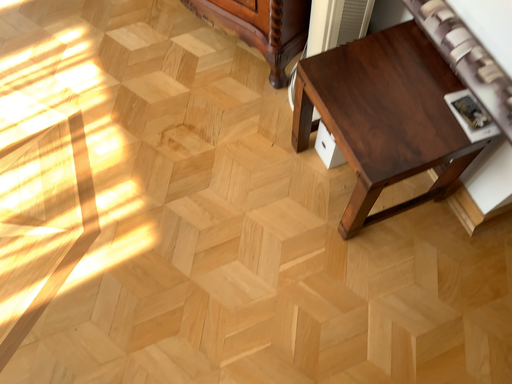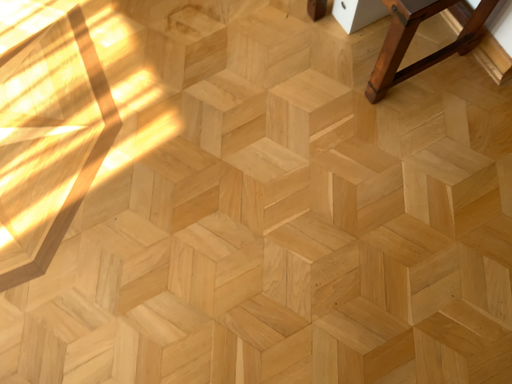
Question: How did the camera likely rotate when shooting the video?

Choices:
 (A) rotated downward
 (B) rotated upward

Answer: (A)